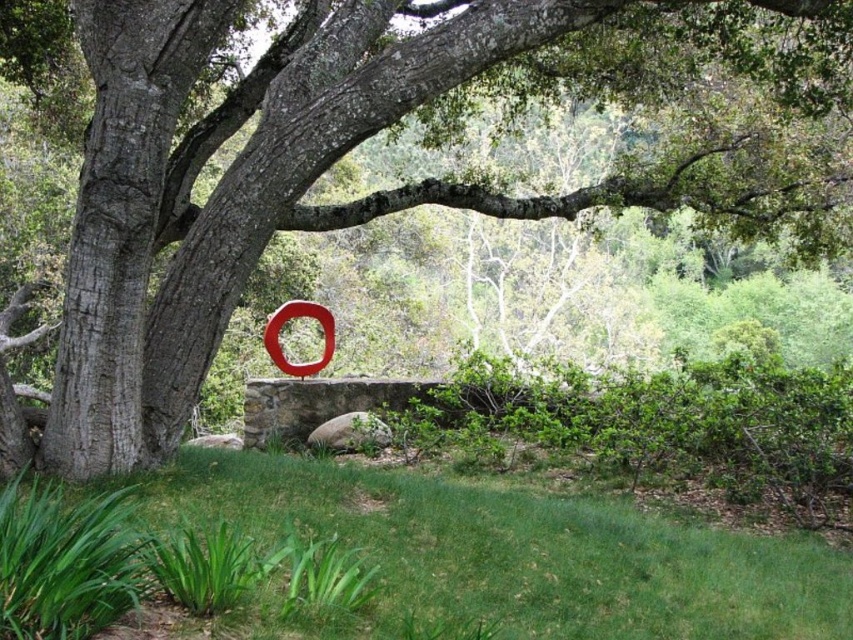
Is green grassy at lower center positioned in front of smooth red circle at center?

Yes, green grassy at lower center is closer to the viewer.

Is green grassy at lower center positioned behind smooth red circle at center?

No, it is in front of smooth red circle at center.

Where is `green grassy at lower center`? This screenshot has height=640, width=853. green grassy at lower center is located at coordinates (437, 557).